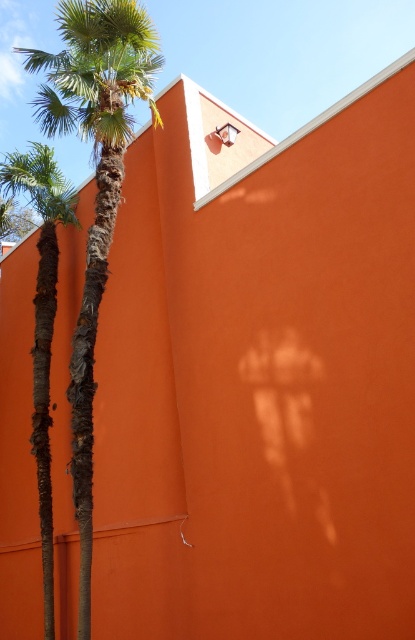
Question: In this image, where is green leafy palm tree at left located relative to green textured palm tree at left?

Choices:
 (A) right
 (B) left

Answer: (A)

Question: Which of the following is the farthest from the observer?

Choices:
 (A) pos(53,163)
 (B) pos(85,6)

Answer: (A)

Question: Does green leafy palm tree at left have a greater width compared to green textured palm tree at left?

Choices:
 (A) no
 (B) yes

Answer: (B)

Question: Is green leafy palm tree at left to the right of green textured palm tree at left from the viewer's perspective?

Choices:
 (A) yes
 (B) no

Answer: (A)

Question: Among these points, which one is nearest to the camera?

Choices:
 (A) (41, 168)
 (B) (68, 36)

Answer: (B)